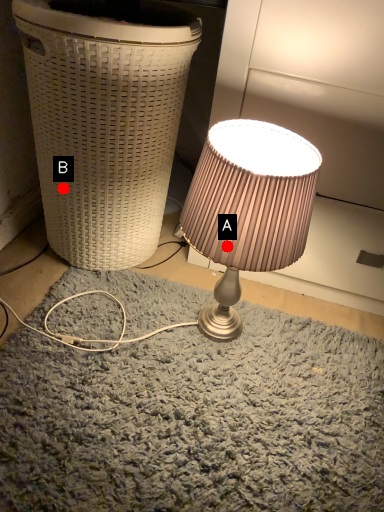
Question: Two points are circled on the image, labeled by A and B beside each circle. Which point is farther to the camera?

Choices:
 (A) A is further
 (B) B is further

Answer: (B)